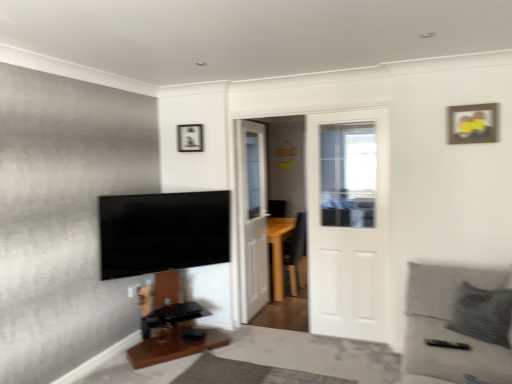
Question: Is gray fabric couch at lower right placed right next to white wooden door at center, placed as the 1th door when sorted from left to right?

Choices:
 (A) yes
 (B) no

Answer: (B)

Question: Is gray fabric couch at lower right bigger than white wooden door at center, which is the 1th door in back-to-front order?

Choices:
 (A) no
 (B) yes

Answer: (B)

Question: Does gray fabric couch at lower right lie behind white wooden door at center, acting as the 2th door starting from the front?

Choices:
 (A) no
 (B) yes

Answer: (A)

Question: Does gray fabric couch at lower right have a lesser height compared to white wooden door at center, acting as the 2th door starting from the front?

Choices:
 (A) yes
 (B) no

Answer: (A)

Question: Considering the relative sizes of gray fabric couch at lower right and white wooden door at center, which is the 1th door in back-to-front order, in the image provided, is gray fabric couch at lower right smaller than white wooden door at center, which is the 1th door in back-to-front order,?

Choices:
 (A) yes
 (B) no

Answer: (B)

Question: Is gray fabric couch at lower right taller than white wooden door at center, placed as the 1th door when sorted from left to right?

Choices:
 (A) no
 (B) yes

Answer: (A)

Question: Is wooden picture frame at upper center, which is counted as the 1th picture frame, starting from the left, oriented away from wooden table at lower center?

Choices:
 (A) yes
 (B) no

Answer: (B)

Question: Does wooden picture frame at upper center, which is counted as the 1th picture frame, starting from the left, have a lesser width compared to wooden table at lower center?

Choices:
 (A) no
 (B) yes

Answer: (B)

Question: Is wooden picture frame at upper center, which ranks as the second picture frame in right-to-left order, far from wooden table at lower center?

Choices:
 (A) no
 (B) yes

Answer: (B)

Question: Is wooden picture frame at upper center, which is counted as the 1th picture frame, starting from the left, facing towards wooden table at lower center?

Choices:
 (A) no
 (B) yes

Answer: (A)

Question: Is wooden picture frame at upper center, the first picture frame from the back, bigger than wooden table at lower center?

Choices:
 (A) yes
 (B) no

Answer: (B)

Question: Considering the relative sizes of wooden picture frame at upper center, which is counted as the 1th picture frame, starting from the left, and wooden table at lower center in the image provided, is wooden picture frame at upper center, which is counted as the 1th picture frame, starting from the left, shorter than wooden table at lower center?

Choices:
 (A) no
 (B) yes

Answer: (B)

Question: From the image's perspective, is wooden picture frame at upper right, which appears as the second picture frame when viewed from the back, located beneath wooden table at lower center?

Choices:
 (A) yes
 (B) no

Answer: (B)